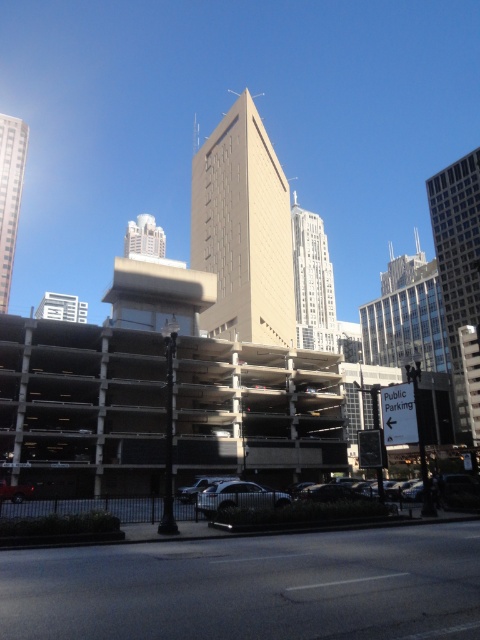
Does matte glass skyscraper at upper left lie in front of white glossy building at upper left?

Yes, matte glass skyscraper at upper left is in front of white glossy building at upper left.

Is matte glass skyscraper at upper left smaller than white glossy building at upper left?

No, matte glass skyscraper at upper left is not smaller than white glossy building at upper left.

Which is behind, point (6, 269) or point (132, 227)?

Point (132, 227)

Locate an element on the screen. The width and height of the screenshot is (480, 640). matte glass skyscraper at upper left is located at coordinates (10, 195).

The height and width of the screenshot is (640, 480). Describe the element at coordinates (243, 230) in the screenshot. I see `beige concrete building at center` at that location.

Does beige concrete building at center appear under glass skyscraper at right?

Incorrect, beige concrete building at center is not positioned below glass skyscraper at right.

The width and height of the screenshot is (480, 640). Identify the location of beige concrete building at center. (243, 230).

Can you confirm if gold glass skyscraper at center is taller than white glossy building at upper left?

Yes, gold glass skyscraper at center is taller than white glossy building at upper left.

Which is above, gold glass skyscraper at center or white glossy building at upper left?

white glossy building at upper left is above.

Where is `gold glass skyscraper at center`? This screenshot has height=640, width=480. gold glass skyscraper at center is located at coordinates (x=312, y=282).